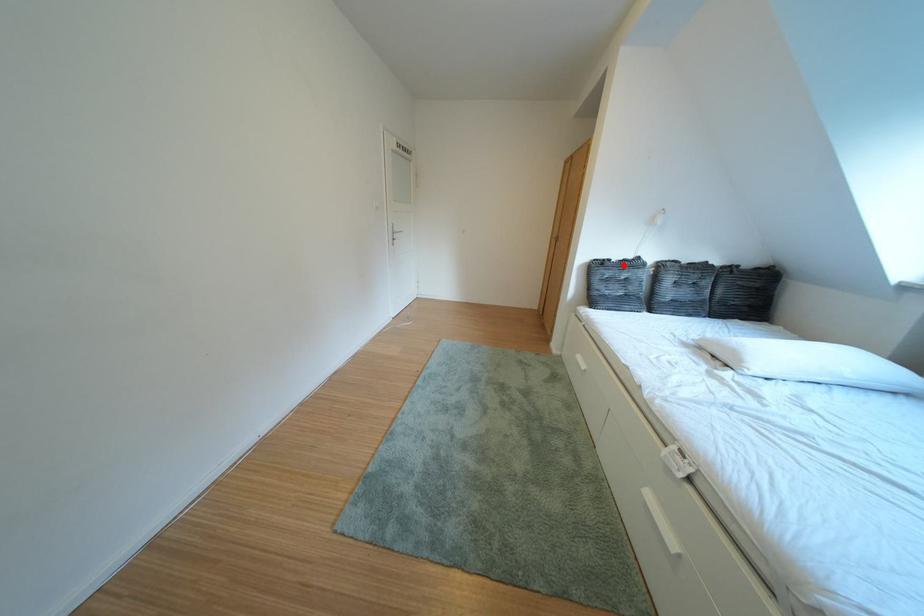
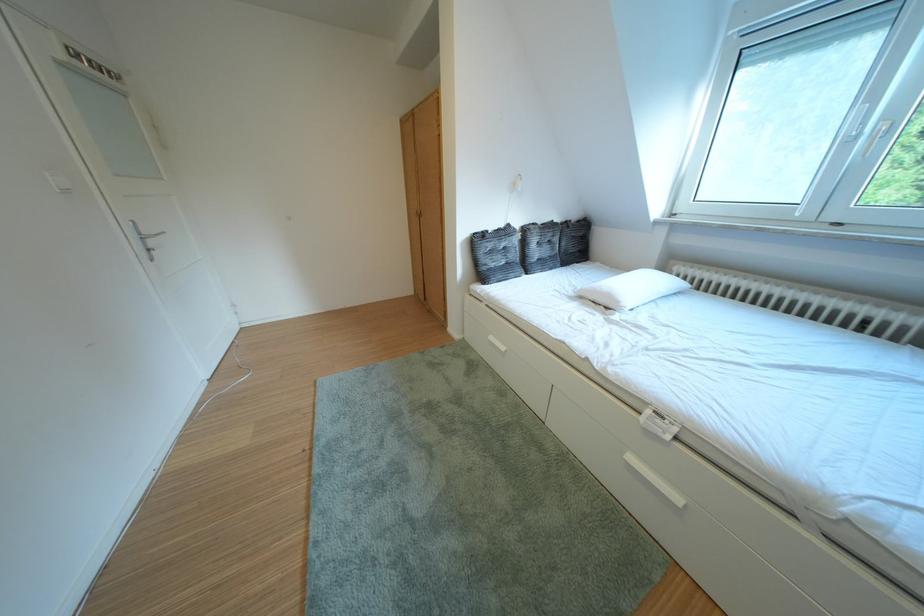
Locate, in the second image, the point that corresponds to the highlighted location in the first image.

(500, 237)